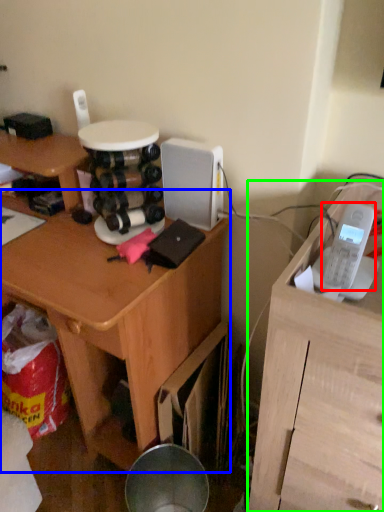
Question: Estimate the real-world distances between objects in this image. Which object is farther from ipod (highlighted by a red box), desk (highlighted by a blue box) or furniture (highlighted by a green box)?

Choices:
 (A) desk
 (B) furniture

Answer: (A)